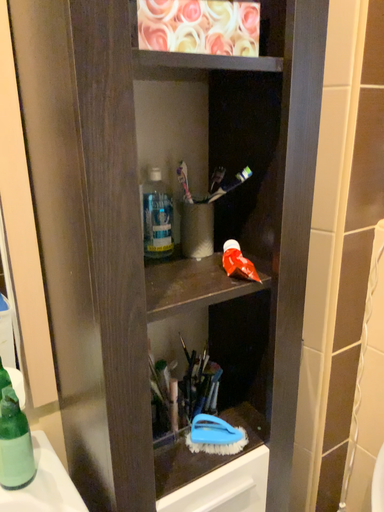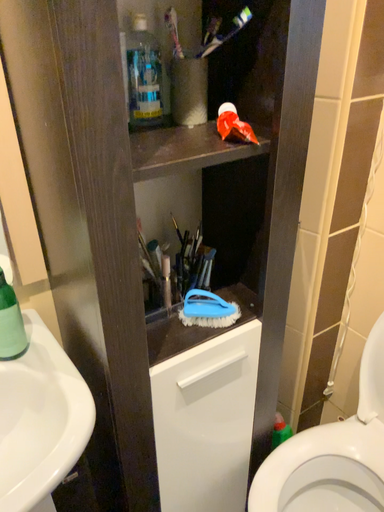
Question: Which way did the camera rotate in the video?

Choices:
 (A) rotated upward
 (B) rotated downward

Answer: (B)